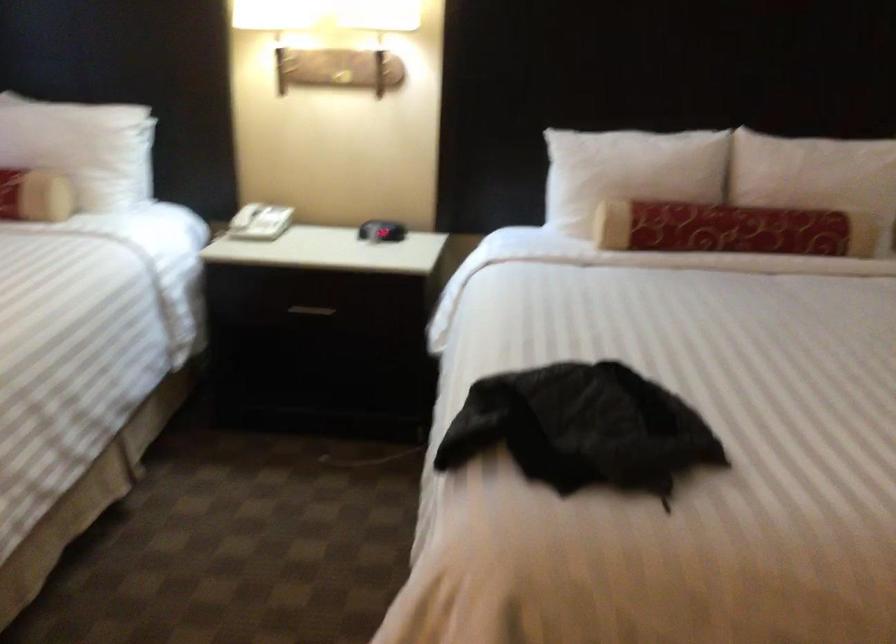
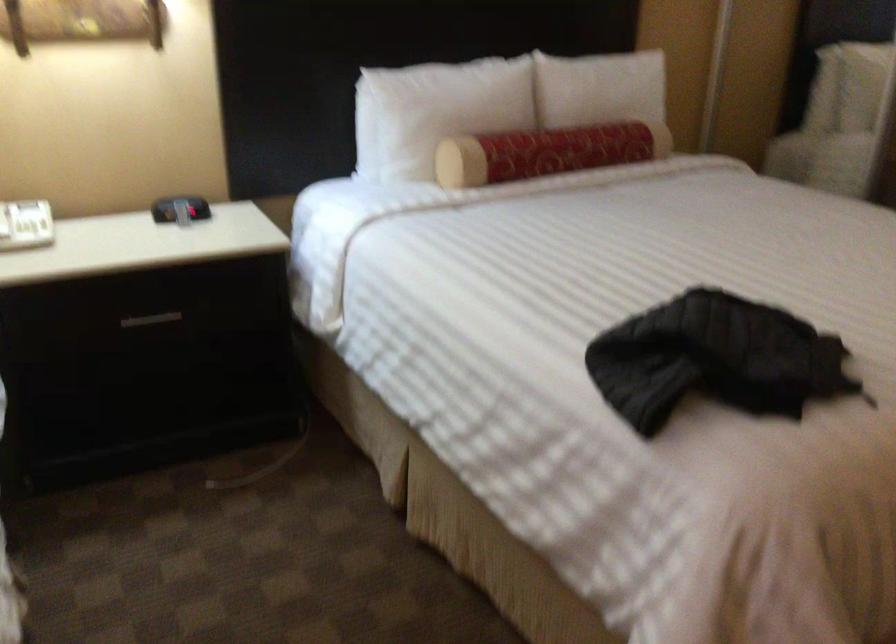
Question: The first image is from the beginning of the video and the second image is from the end. How did the camera likely rotate when shooting the video?

Choices:
 (A) Left
 (B) Right
 (C) Up
 (D) Down

Answer: (B)